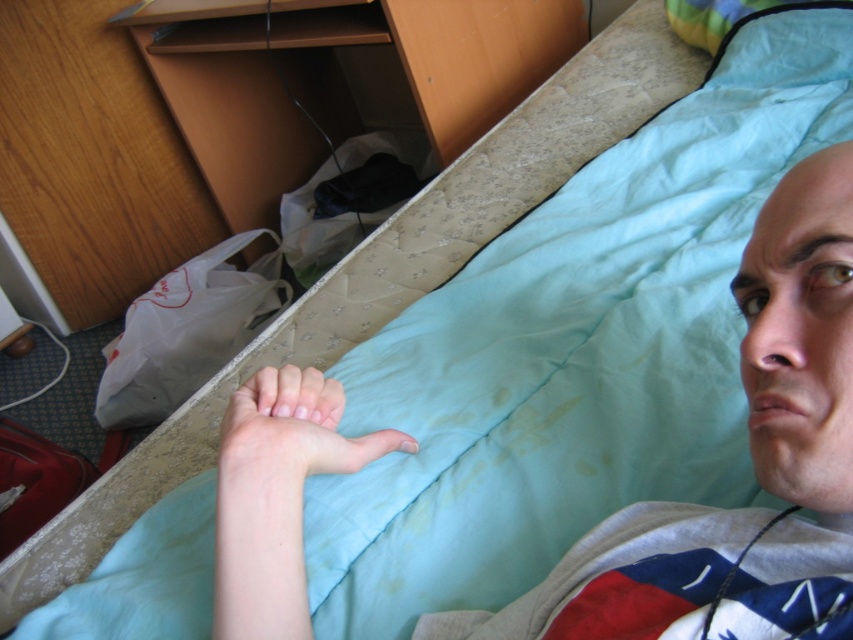
Question: Does pale skin at lower center lie behind pale skin hand at lower center?

Choices:
 (A) yes
 (B) no

Answer: (B)

Question: Can you confirm if pale skin at lower center is positioned to the right of pale skin hand at lower center?

Choices:
 (A) no
 (B) yes

Answer: (A)

Question: Which point is closer to the camera taking this photo?

Choices:
 (A) (225, 602)
 (B) (314, 396)

Answer: (A)

Question: Which of the following is the farthest from the observer?

Choices:
 (A) (286, 586)
 (B) (294, 592)

Answer: (B)

Question: Can you confirm if pale skin at lower center is thinner than pale skin hand at lower center?

Choices:
 (A) yes
 (B) no

Answer: (A)